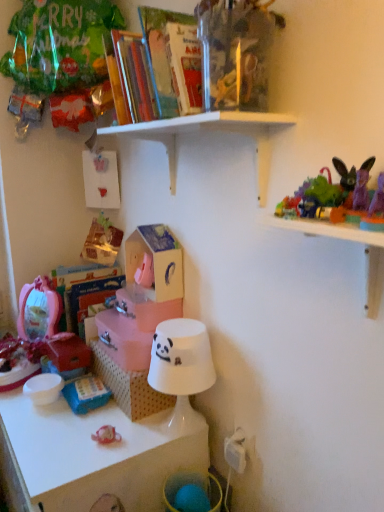
Find the location of a particular element. vacant area on top of white glossy lampshade at lower center, which ranks as the first shelf in bottom-to-top order (from a real-world perspective) is located at coordinates (78, 419).